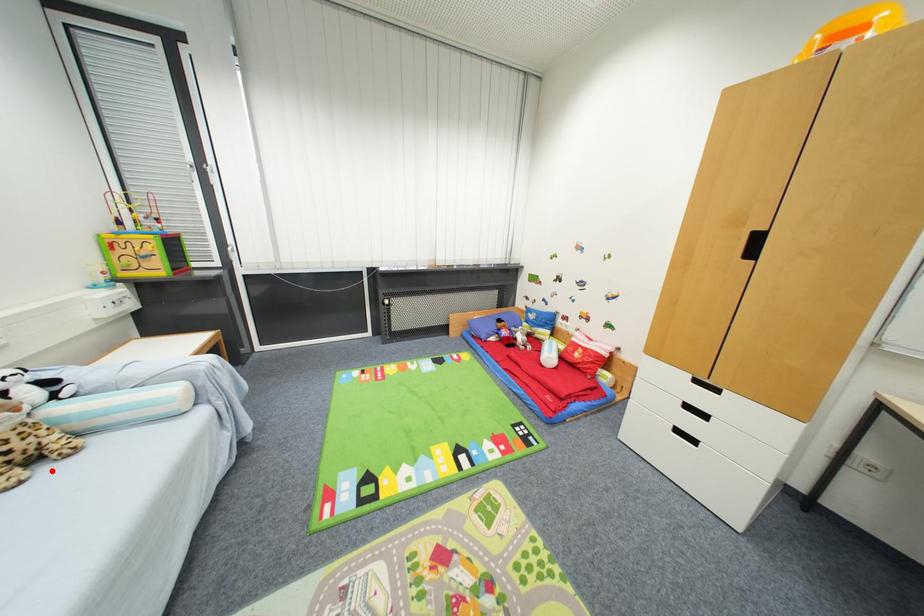
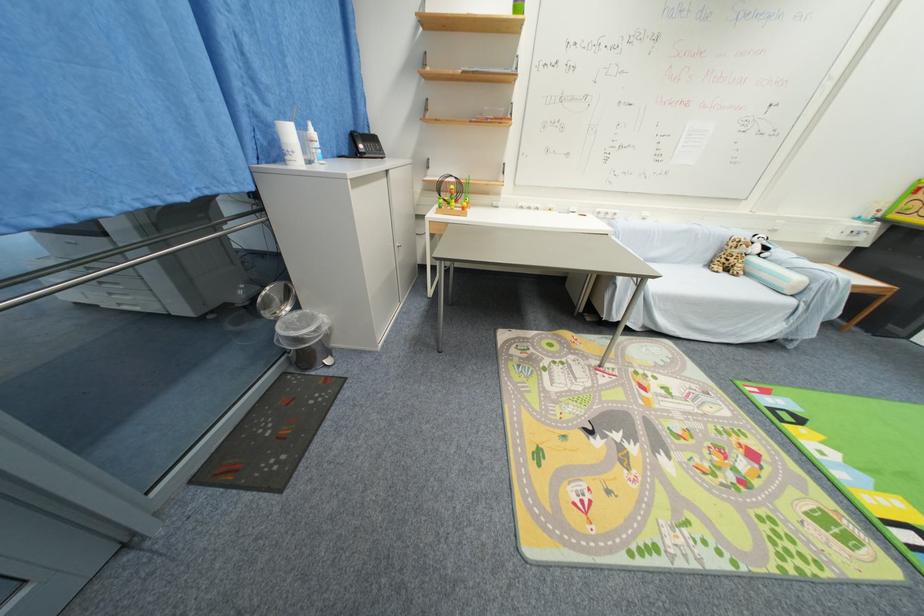
Locate, in the second image, the point that corresponds to the highlighted location in the first image.

(730, 276)